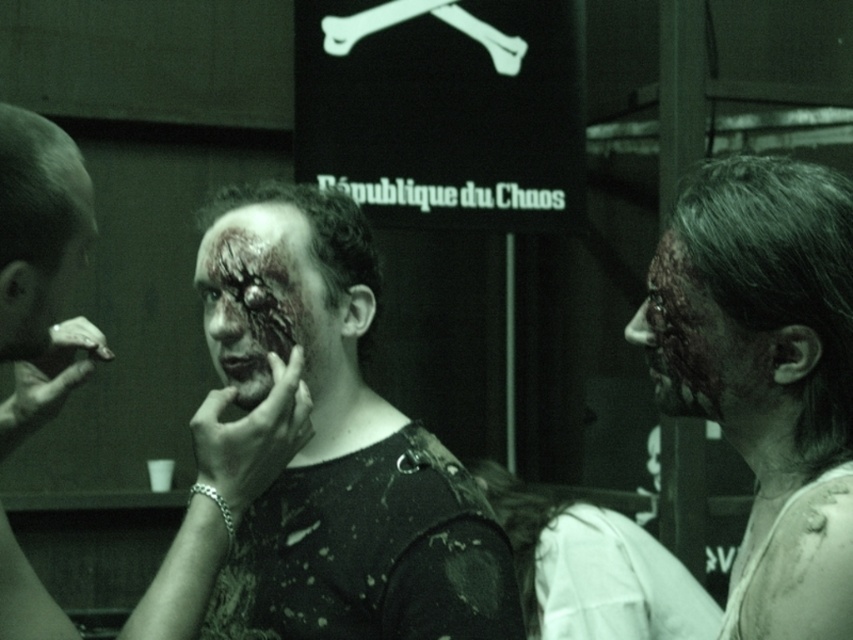
Consider the image. Does shiny silver ring at left have a lesser width compared to grungy textured face at right?

Incorrect, shiny silver ring at left's width is not less than grungy textured face at right's.

In the scene shown: Does shiny silver ring at left appear on the right side of grungy textured face at right?

Incorrect, shiny silver ring at left is not on the right side of grungy textured face at right.

What do you see at coordinates (41, 269) in the screenshot?
I see `shiny silver ring at left` at bounding box center [41, 269].

The image size is (853, 640). In order to click on shiny silver ring at left in this screenshot , I will do `click(41, 269)`.

Is matte black shirt at center to the right of grungy textured face at right from the viewer's perspective?

No, matte black shirt at center is not to the right of grungy textured face at right.

What do you see at coordinates (337, 445) in the screenshot? The image size is (853, 640). I see `matte black shirt at center` at bounding box center [337, 445].

The height and width of the screenshot is (640, 853). I want to click on matte black shirt at center, so click(337, 445).

What are the coordinates of `matte black shirt at center` in the screenshot? It's located at (337, 445).

Does matte black shirt at center appear under matte black face at left?

Correct, matte black shirt at center is located below matte black face at left.

Does point (281, 556) lie in front of point (65, 173)?

No, it is behind (65, 173).

I want to click on matte black shirt at center, so click(337, 445).